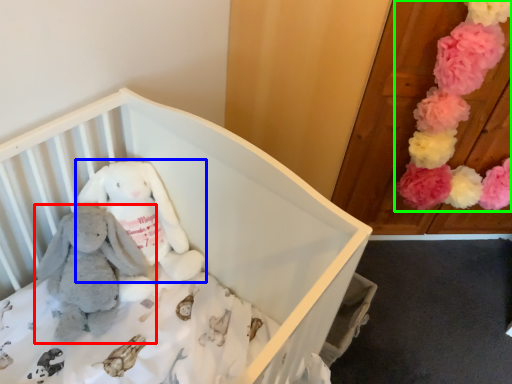
Question: Considering the real-world distances, which object is farthest from toy (highlighted by a red box)? toy (highlighted by a blue box) or toy (highlighted by a green box)?

Choices:
 (A) toy
 (B) toy

Answer: (B)